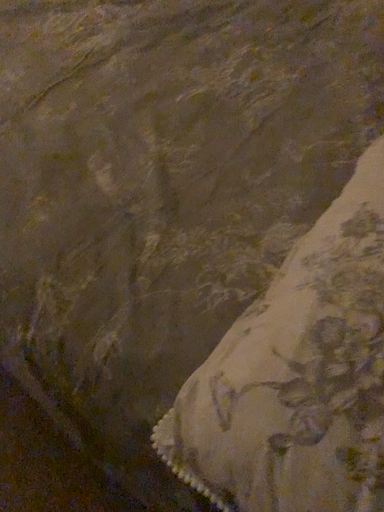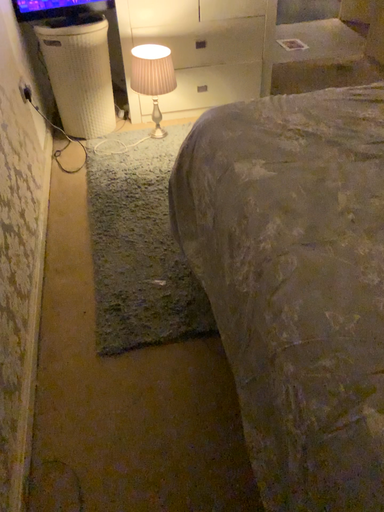
Question: How did the camera likely rotate when shooting the video?

Choices:
 (A) rotated upward
 (B) rotated downward

Answer: (A)